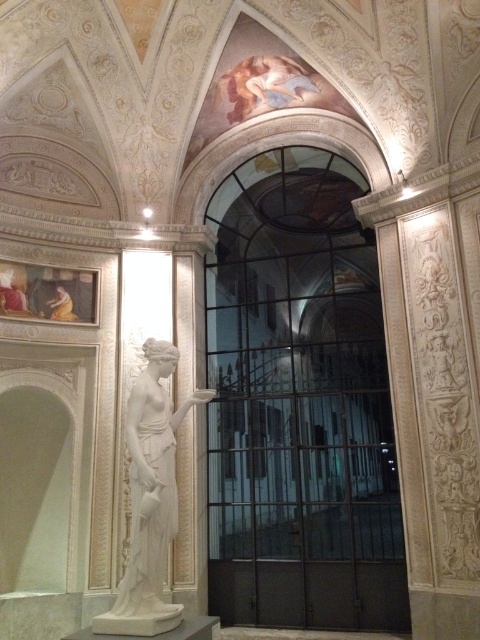
Is metallic gate at center to the right of white marble statue at center from the viewer's perspective?

Yes, metallic gate at center is to the right of white marble statue at center.

Which is below, metallic gate at center or white marble statue at center?

white marble statue at center

Is point (228, 250) less distant than point (166, 481)?

No, (228, 250) is behind (166, 481).

You are a GUI agent. You are given a task and a screenshot of the screen. Output one action in this format:
    pyautogui.click(x=<x>, y=<y>)
    Task: Click on the metallic gate at center
    The width and height of the screenshot is (480, 640).
    Given the screenshot: What is the action you would take?
    pyautogui.click(x=300, y=403)